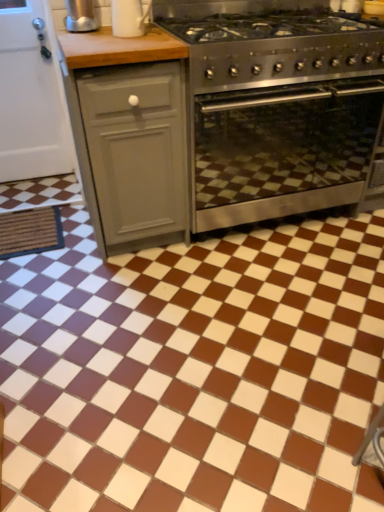
At what (x,y) coordinates should I click in order to perform the action: click on free location in front of stainless steel oven at center. Please return your answer as a coordinate pair (x, y). The width and height of the screenshot is (384, 512). Looking at the image, I should click on (266, 289).